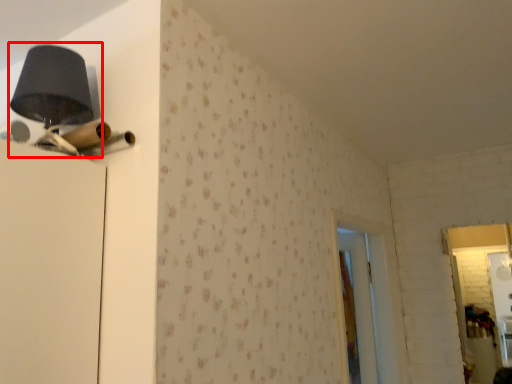
Question: From the image's perspective, where is table lamp (annotated by the red box) located relative to screen door?

Choices:
 (A) below
 (B) above

Answer: (B)